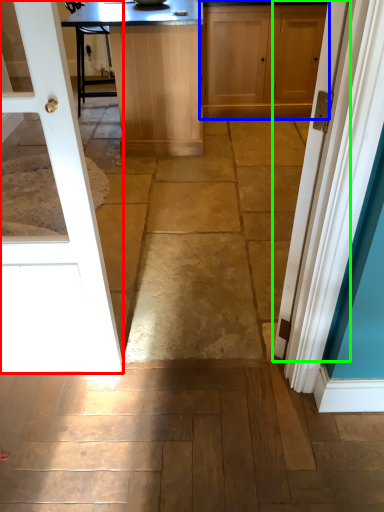
Question: Estimate the real-world distances between objects in this image. Which object is farther from door (highlighted by a red box), cabinetry (highlighted by a blue box) or door (highlighted by a green box)?

Choices:
 (A) cabinetry
 (B) door

Answer: (A)